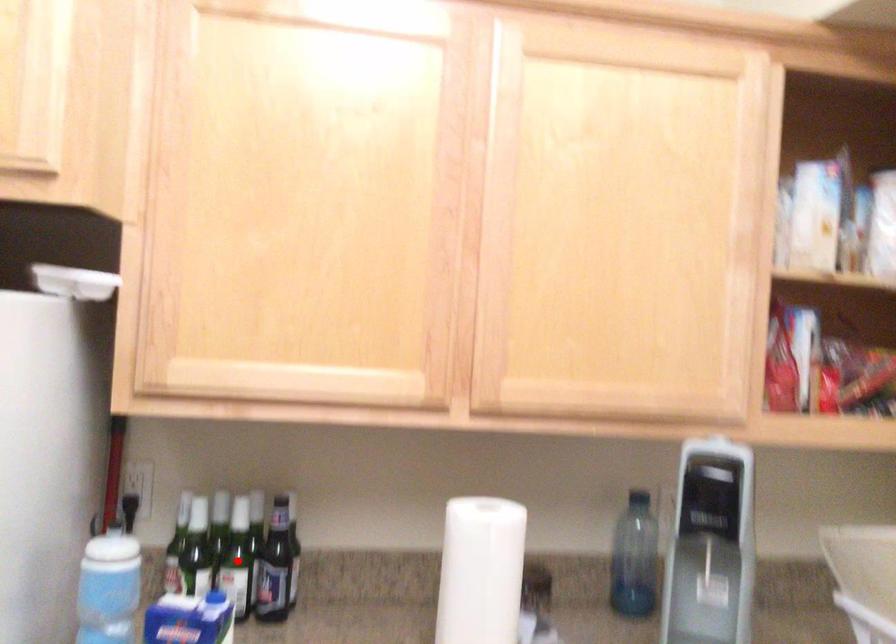
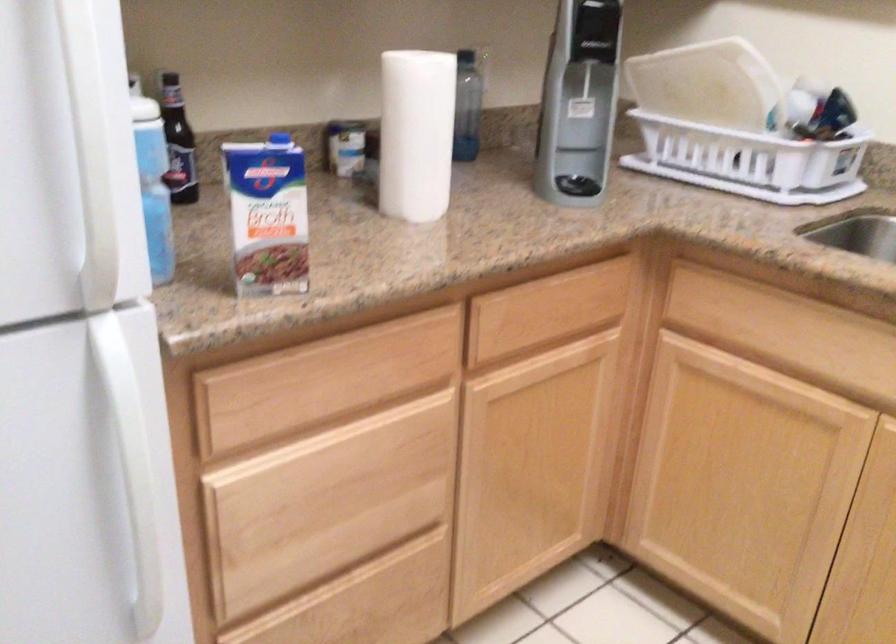
Question: I am providing you with two images of the same scene from different viewpoints. A red point is marked on the first image. Can you still see the location of the red point in image 2?

Choices:
 (A) Yes
 (B) No

Answer: (B)